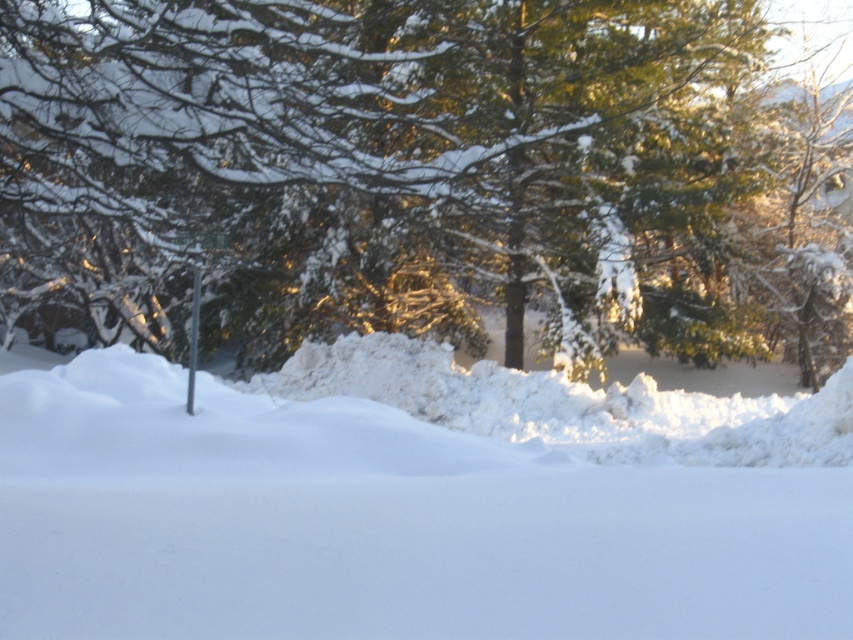
You are a snowplow operator needing to clear a path between the white fluffy snow at center and the metallic pole at center. The plow can only move in a straight line and requires a minimum of 4 meters of space to operate safely. Based on the scene, can you safely operate the plow between these two areas?

The distance between the white fluffy snow at center and the metallic pole at center is 3.85 meters, which is less than the required 4 meters. Therefore, the snowplow cannot operate safely between these two areas due to insufficient space.

You are standing at the edge of the snowy area and want to walk towards the green textured pine tree at center and the metallic pole at center. Which one will you reach first?

The metallic pole at center is to the left of the green textured pine tree at center, so you will reach the metallic pole at center first.

In the scene shown: You are a photographer planning to capture a winter landscape. You notice the green textured pine tree at center and the white fluffy snow at center. Which object will appear wider in your photo?

The green textured pine tree at center will appear wider in the photo because its width surpasses that of the white fluffy snow at center.